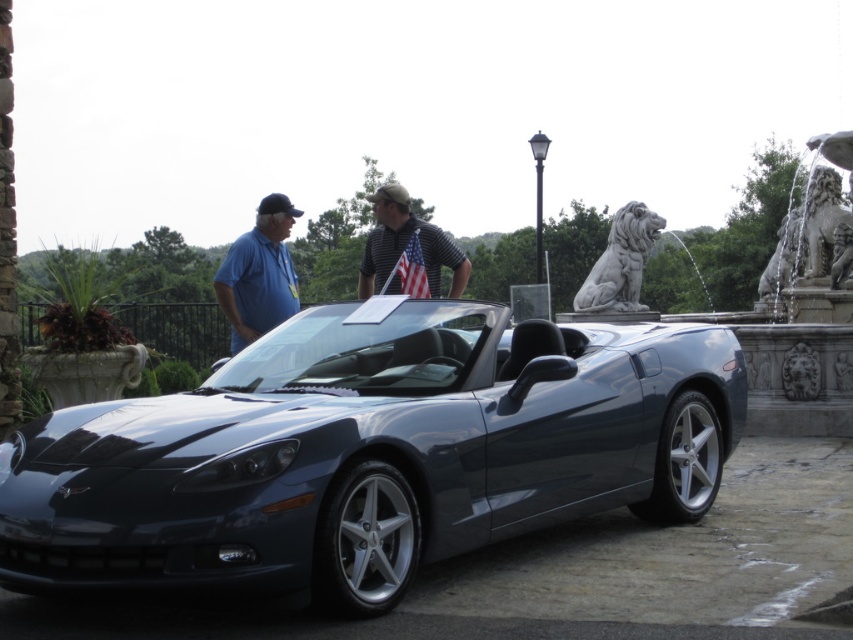
Question: Observing the image, what is the correct spatial positioning of glossy metallic sports car at center in reference to gray stone lion at upper right?

Choices:
 (A) above
 (B) below

Answer: (B)

Question: Observing the image, what is the correct spatial positioning of white stone lion at right in reference to striped polo shirt at center?

Choices:
 (A) below
 (B) above

Answer: (A)

Question: Which point is farther to the camera?

Choices:
 (A) striped polo shirt at center
 (B) blue cotton shirt at left
 (C) gray stone lion at upper right

Answer: (C)

Question: Which of the following is the closest to the observer?

Choices:
 (A) white stone lion at right
 (B) glossy metallic sports car at center

Answer: (B)

Question: Which object appears farthest from the camera in this image?

Choices:
 (A) glossy metallic sports car at center
 (B) gray stone lion at upper right

Answer: (B)

Question: Can you confirm if glossy metallic sports car at center is positioned above striped polo shirt at center?

Choices:
 (A) yes
 (B) no

Answer: (B)